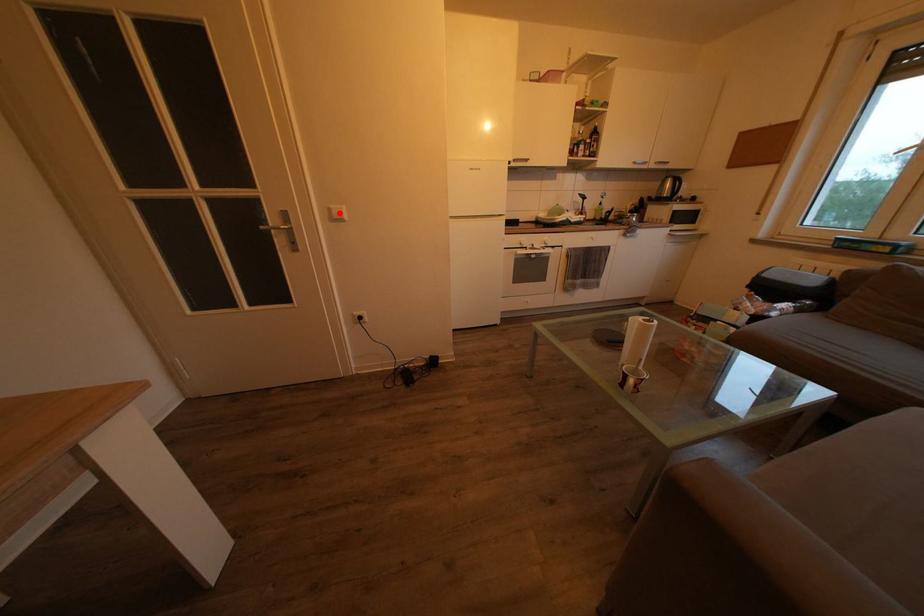
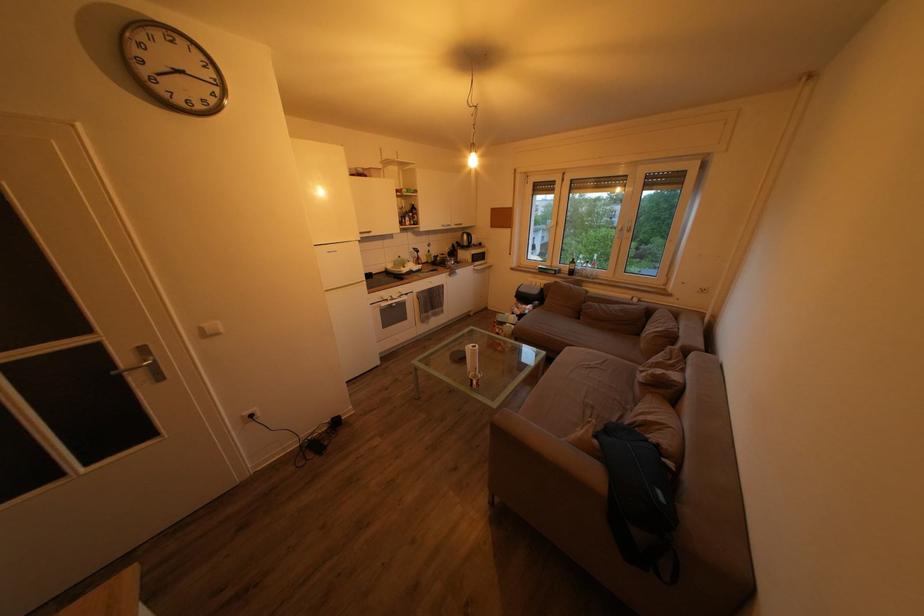
In the second image, find the point that corresponds to the highlighted location in the first image.

(211, 331)